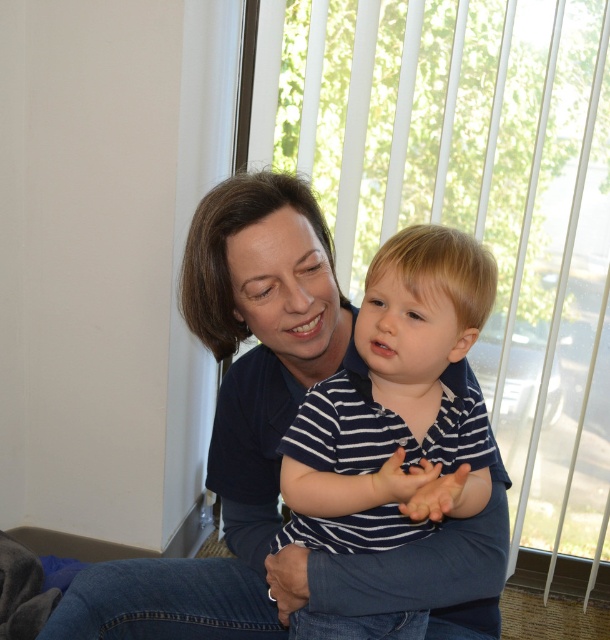
Question: Which point is farther to the camera?

Choices:
 (A) striped cotton shirt at center
 (B) matte blue shirt at center

Answer: (B)

Question: Observing the image, what is the correct spatial positioning of matte blue shirt at center in reference to striped cotton shirt at center?

Choices:
 (A) right
 (B) left

Answer: (B)

Question: Which point is farther from the camera taking this photo?

Choices:
 (A) (458, 273)
 (B) (264, 557)

Answer: (B)

Question: Where is matte blue shirt at center located in relation to striped cotton shirt at center in the image?

Choices:
 (A) above
 (B) below

Answer: (A)

Question: Is matte blue shirt at center to the right of striped cotton shirt at center from the viewer's perspective?

Choices:
 (A) no
 (B) yes

Answer: (A)